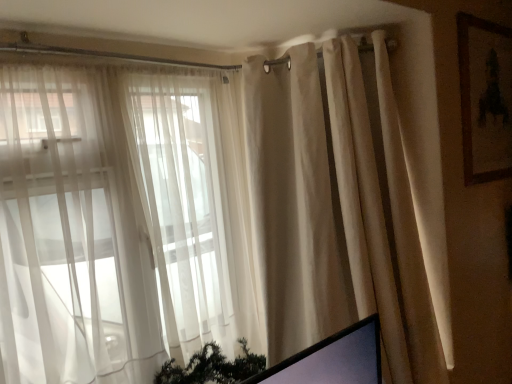
Question: From a real-world perspective, is brown wooden picture frame at upper right physically located above or below sheer white curtains at left?

Choices:
 (A) below
 (B) above

Answer: (B)

Question: From the image's perspective, is brown wooden picture frame at upper right located above or below sheer white curtains at left?

Choices:
 (A) above
 (B) below

Answer: (A)

Question: Estimate the real-world distances between objects in this image. Which object is closer to the beige fabric curtain at right?

Choices:
 (A) sheer white curtains at left
 (B) brown wooden picture frame at upper right

Answer: (A)

Question: Considering the real-world distances, which object is closest to the brown wooden picture frame at upper right?

Choices:
 (A) beige fabric curtain at right
 (B) sheer white curtains at left

Answer: (A)